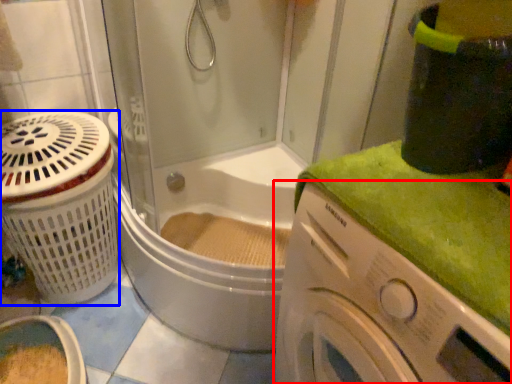
Question: Which object appears closest to the camera in this image, washing machine (highlighted by a red box) or basket (highlighted by a blue box)?

Choices:
 (A) washing machine
 (B) basket

Answer: (A)